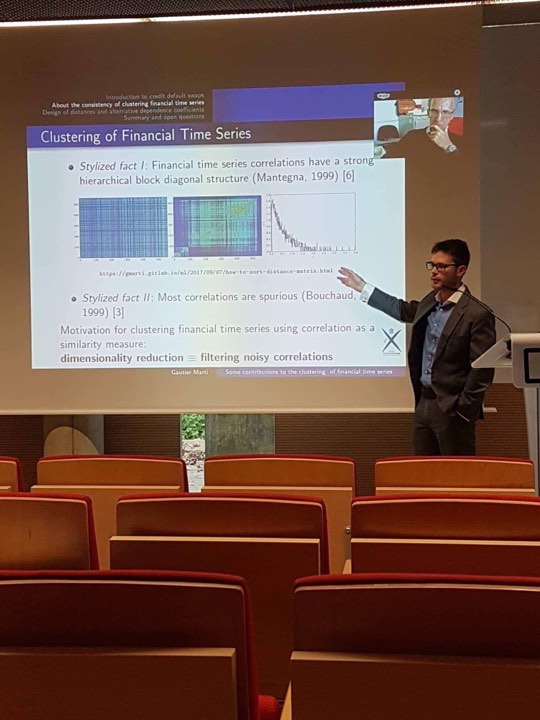
I want to click on screen, so coord(313,397).